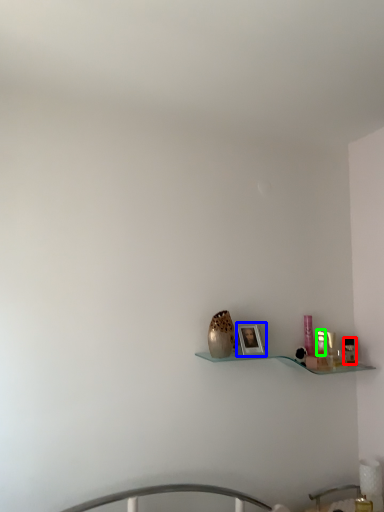
Question: Which object is the closest to the toiletry (highlighted by a red box)? Choose among these: picture frame (highlighted by a blue box) or toiletry (highlighted by a green box).

Choices:
 (A) picture frame
 (B) toiletry

Answer: (B)